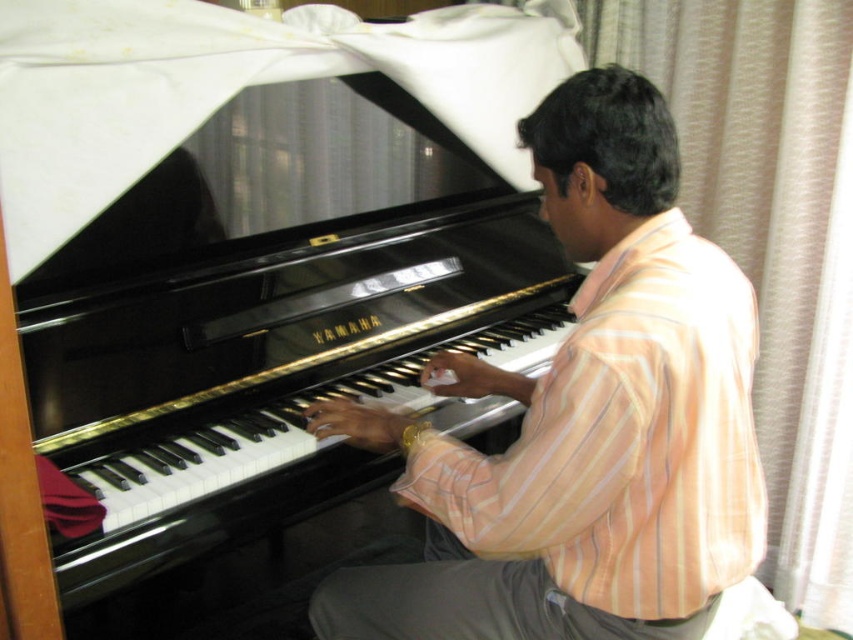
Question: Can you confirm if striped cotton shirt at center is positioned below black polished piano at center?

Choices:
 (A) no
 (B) yes

Answer: (B)

Question: Does striped cotton shirt at center have a lesser width compared to black polished piano at center?

Choices:
 (A) no
 (B) yes

Answer: (B)

Question: Which point is closer to the camera taking this photo?

Choices:
 (A) (569, 433)
 (B) (277, 243)

Answer: (A)

Question: Is striped cotton shirt at center bigger than black polished piano at center?

Choices:
 (A) yes
 (B) no

Answer: (B)

Question: Which object appears closest to the camera in this image?

Choices:
 (A) striped cotton shirt at center
 (B) black polished piano at center

Answer: (A)